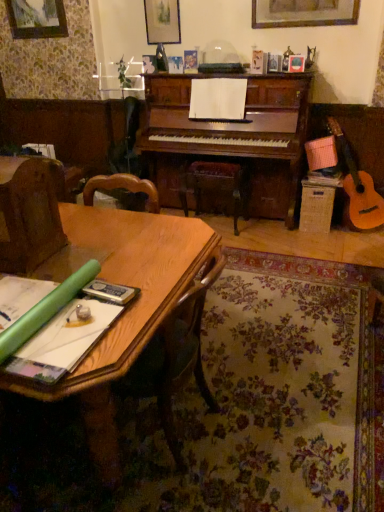
Question: Is brown fabric armchair at left bigger than wooden picture frame at upper left?

Choices:
 (A) no
 (B) yes

Answer: (B)

Question: Is brown fabric armchair at left surrounding wooden picture frame at upper left?

Choices:
 (A) no
 (B) yes

Answer: (A)

Question: Is brown fabric armchair at left shorter than wooden picture frame at upper left?

Choices:
 (A) yes
 (B) no

Answer: (B)

Question: Does brown fabric armchair at left appear on the right side of wooden picture frame at upper left?

Choices:
 (A) no
 (B) yes

Answer: (B)

Question: From the image's perspective, is brown fabric armchair at left over wooden picture frame at upper left?

Choices:
 (A) no
 (B) yes

Answer: (A)

Question: Is point (69, 350) positioned closer to the camera than point (54, 207)?

Choices:
 (A) farther
 (B) closer

Answer: (B)

Question: From a real-world perspective, is green paper at lower left above or below brown fabric armchair at left?

Choices:
 (A) above
 (B) below

Answer: (B)

Question: Based on their sizes in the image, would you say green paper at lower left is bigger or smaller than brown fabric armchair at left?

Choices:
 (A) big
 (B) small

Answer: (B)

Question: From their relative heights in the image, would you say green paper at lower left is taller or shorter than brown fabric armchair at left?

Choices:
 (A) tall
 (B) short

Answer: (B)

Question: Considering the positions of point (61, 16) and point (236, 202), is point (61, 16) closer or farther from the camera than point (236, 202)?

Choices:
 (A) closer
 (B) farther

Answer: (B)

Question: Choose the correct answer: Is wooden picture frame at upper left inside wooden at center or outside it?

Choices:
 (A) inside
 (B) outside

Answer: (B)

Question: Is wooden picture frame at upper left in front of or behind wooden at center in the image?

Choices:
 (A) front
 (B) behind

Answer: (B)

Question: From the image's perspective, relative to wooden at center, is wooden picture frame at upper left above or below?

Choices:
 (A) below
 (B) above

Answer: (B)

Question: Would you say brown fabric armchair at left is inside or outside wooden picture frame at upper left?

Choices:
 (A) inside
 (B) outside

Answer: (B)

Question: Does point (13, 185) appear closer or farther from the camera than point (49, 7)?

Choices:
 (A) closer
 (B) farther

Answer: (A)